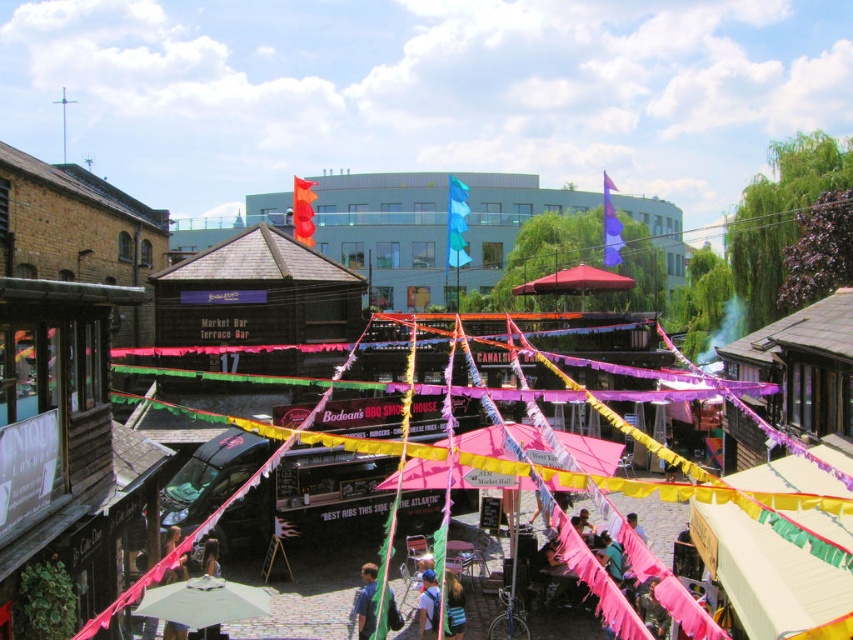
Between point (300, 196) and point (172, 540), which one is positioned in front?

Point (172, 540)

Does orange fabric flag at center have a lesser width compared to light brown hair at lower center?

In fact, orange fabric flag at center might be wider than light brown hair at lower center.

At what (x,y) coordinates should I click in order to perform the action: click on orange fabric flag at center. Please return your answer as a coordinate pair (x, y). Looking at the image, I should click on point(303,211).

Locate an element on the screen. The image size is (853, 640). orange fabric flag at center is located at coordinates pyautogui.click(x=303, y=211).

Does orange fabric flag at center have a lesser height compared to blue fabric backpack at center?

No, orange fabric flag at center is not shorter than blue fabric backpack at center.

Measure the distance between point (305, 237) and camera.

Point (305, 237) is 200.77 feet from camera.

Measure the distance between orange fabric flag at center and camera.

50.75 meters

Find the location of a particular element. Image resolution: width=853 pixels, height=640 pixels. orange fabric flag at center is located at coordinates (303, 211).

Can you confirm if pink fabric umbrella at center is bigger than blue fabric backpack at center?

Correct, pink fabric umbrella at center is larger in size than blue fabric backpack at center.

Is pink fabric umbrella at center closer to the viewer compared to blue fabric backpack at center?

Yes, pink fabric umbrella at center is in front of blue fabric backpack at center.

Who is more forward, (560,436) or (427,593)?

Point (427,593) is in front.

Identify the location of pink fabric umbrella at center. This screenshot has width=853, height=640. (590, 452).